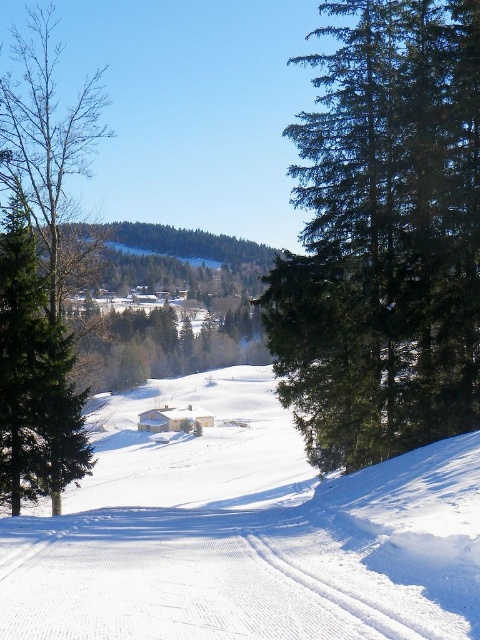
You are standing at the end of the snow path and want to walk towards the houses. Which tree, the green matte tree at right or the brown textured tree at left, will you pass by first?

The green matte tree at right will be passed first because it is closer to the viewer than the brown textured tree at left.